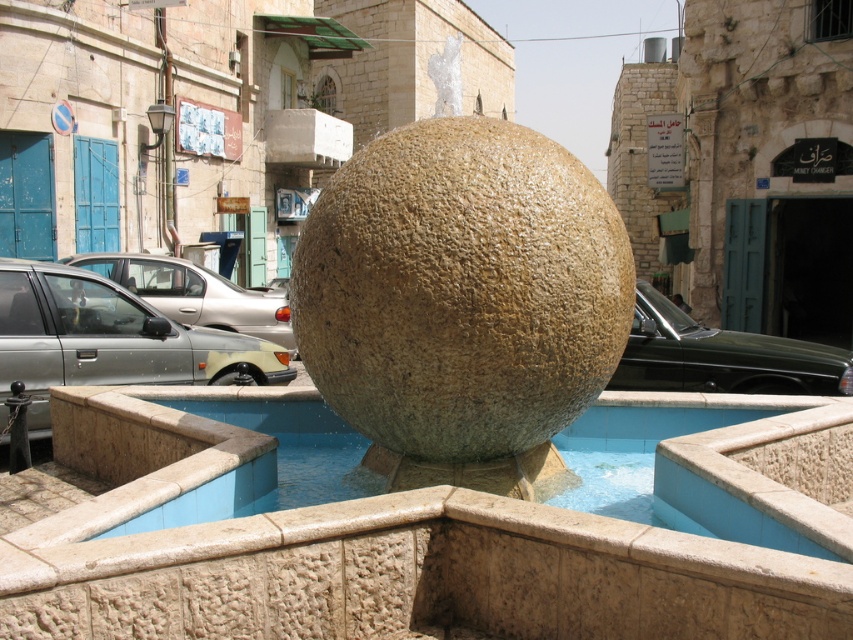
Question: Which of the following is the farthest from the observer?

Choices:
 (A) (163, 264)
 (B) (13, 332)
 (C) (492, 410)
 (D) (675, 369)

Answer: (A)

Question: Is granite sphere at center positioned at the back of silver metallic car at left?

Choices:
 (A) yes
 (B) no

Answer: (B)

Question: Can you confirm if blue stone pool at center is bigger than silver metallic car at center?

Choices:
 (A) yes
 (B) no

Answer: (B)

Question: Which point is farther from the camera taking this photo?

Choices:
 (A) (743, 516)
 (B) (224, 307)
 (C) (45, 337)
 (D) (396, 490)

Answer: (B)

Question: In this image, where is silver metallic car at center located relative to silver metallic car at left?

Choices:
 (A) below
 (B) above

Answer: (A)

Question: Which of the following is the closest to the observer?

Choices:
 (A) silver metallic car at center
 (B) blue stone pool at center
 (C) silver metallic car at left

Answer: (B)